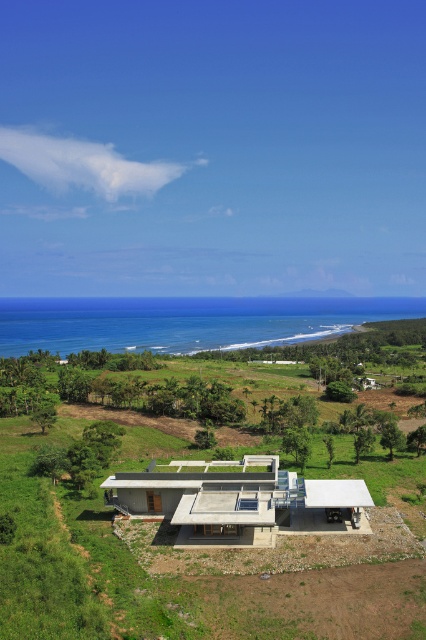
Between blue ocean at lower center and concrete house at center, which one has more height?

With more height is blue ocean at lower center.

Does blue ocean at lower center appear over concrete house at center?

Correct, blue ocean at lower center is located above concrete house at center.

Who is more distant from viewer, (210, 310) or (316, 532)?

The point (210, 310) is behind.

The height and width of the screenshot is (640, 426). Find the location of `blue ocean at lower center`. blue ocean at lower center is located at coordinates (184, 321).